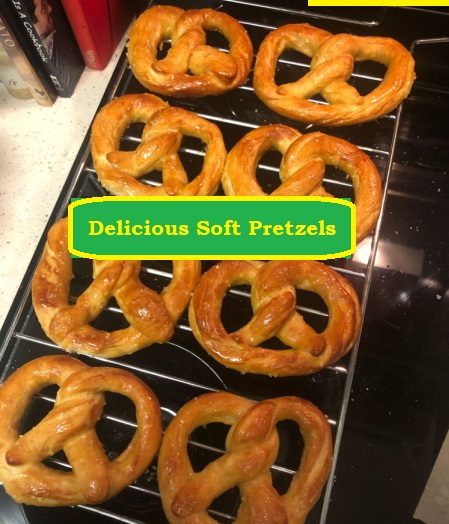
At what (x,y) coordinates should I click in order to perform the action: click on white floor. Please return your answer as a coordinate pair (x, y). The height and width of the screenshot is (524, 449). Looking at the image, I should click on (28, 157).